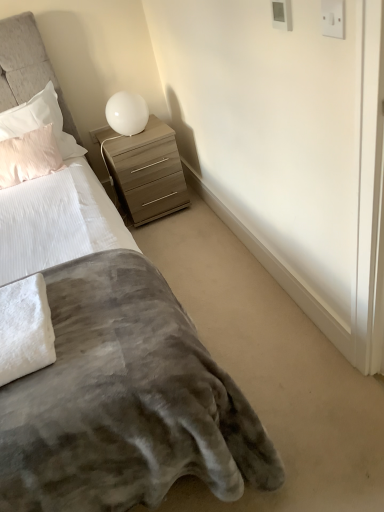
This screenshot has height=512, width=384. In order to click on free space in front of matte wood chest of drawers at upper right in this screenshot , I will do `click(180, 234)`.